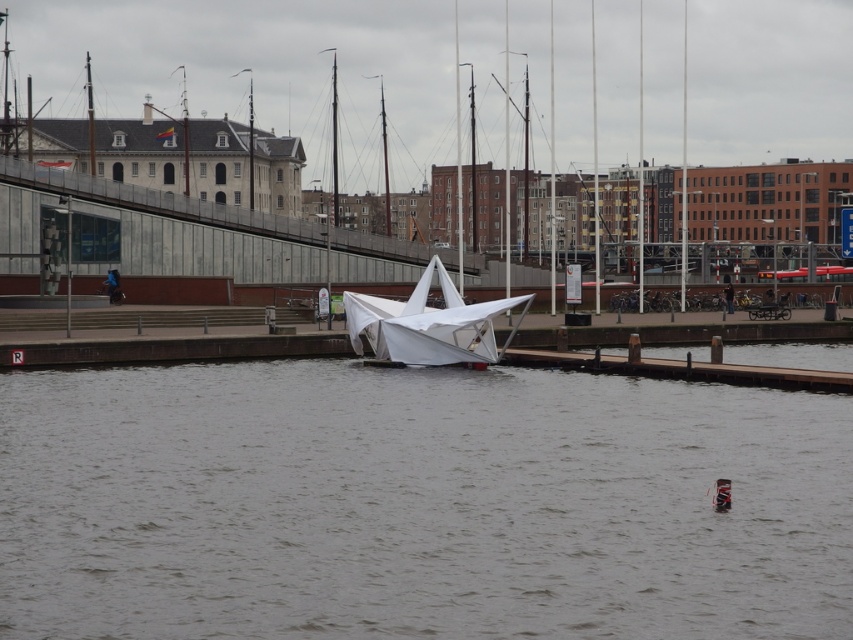
Where is `gray matte water at center`? Image resolution: width=853 pixels, height=640 pixels. gray matte water at center is located at coordinates (416, 504).

Is point (68, 630) positioned after point (434, 324)?

No, (68, 630) is in front of (434, 324).

Where is `gray matte water at center`? The image size is (853, 640). gray matte water at center is located at coordinates (416, 504).